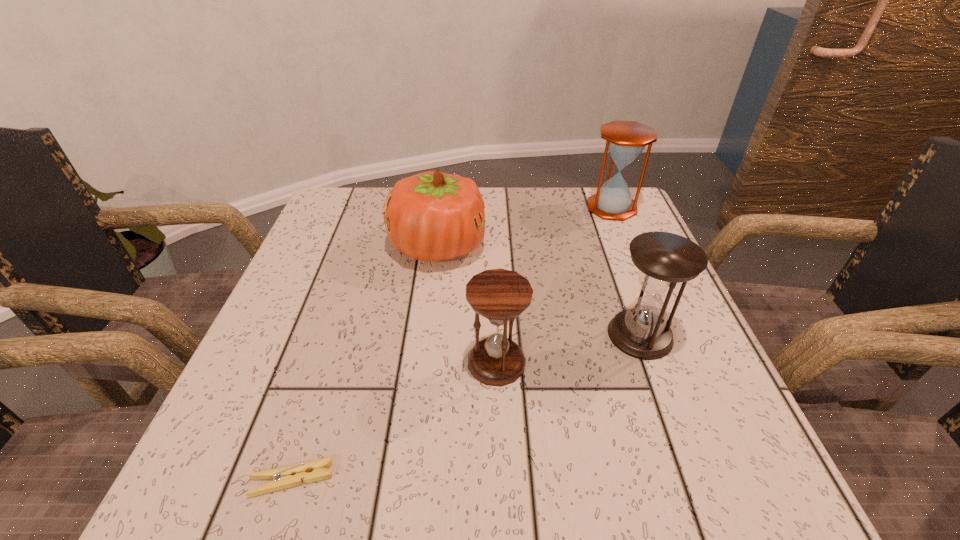
At what (x,y) coordinates should I click in order to perform the action: click on pumpkin located at the far edge. Please return your answer as a coordinate pair (x, y). Looking at the image, I should click on (432, 216).

You are a GUI agent. You are given a task and a screenshot of the screen. Output one action in this format:
    pyautogui.click(x=<x>, y=<y>)
    Task: Click on the object located in the near edge section of the desktop
    
    Given the screenshot: What is the action you would take?
    pyautogui.click(x=289, y=476)

Identify the location of object that is at the left edge. Image resolution: width=960 pixels, height=540 pixels. (289, 476).

Identify the location of object positioned at the near left corner. Image resolution: width=960 pixels, height=540 pixels. (289, 476).

Image resolution: width=960 pixels, height=540 pixels. Find the location of `object present at the far right corner`. object present at the far right corner is located at coordinates (625, 140).

This screenshot has height=540, width=960. Identify the location of vacant space at the far edge of the desktop. (492, 204).

Find the location of a particular element. Image resolution: width=960 pixels, height=540 pixels. vacant region at the near edge is located at coordinates (573, 484).

The height and width of the screenshot is (540, 960). Identify the location of vacant region at the left edge of the desktop. (268, 396).

You are a GUI agent. You are given a task and a screenshot of the screen. Output one action in this format:
    pyautogui.click(x=<x>, y=<y>)
    Task: Click on the free region at the right edge
    This screenshot has height=540, width=960.
    Given the screenshot: What is the action you would take?
    pyautogui.click(x=686, y=319)

Locate an element on the screen. free spot at the far left corner of the desktop is located at coordinates (381, 220).